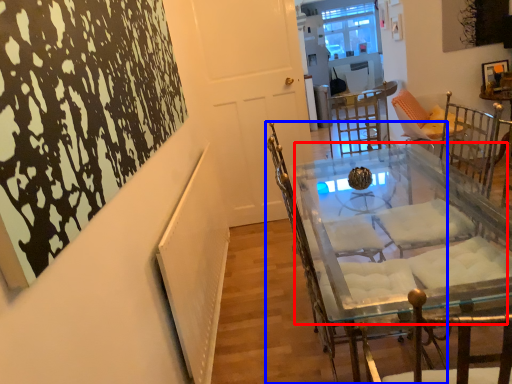
Question: Which of the following is the farthest to the observer, round table (highlighted by a red box) or chair (highlighted by a blue box)?

Choices:
 (A) round table
 (B) chair

Answer: (B)